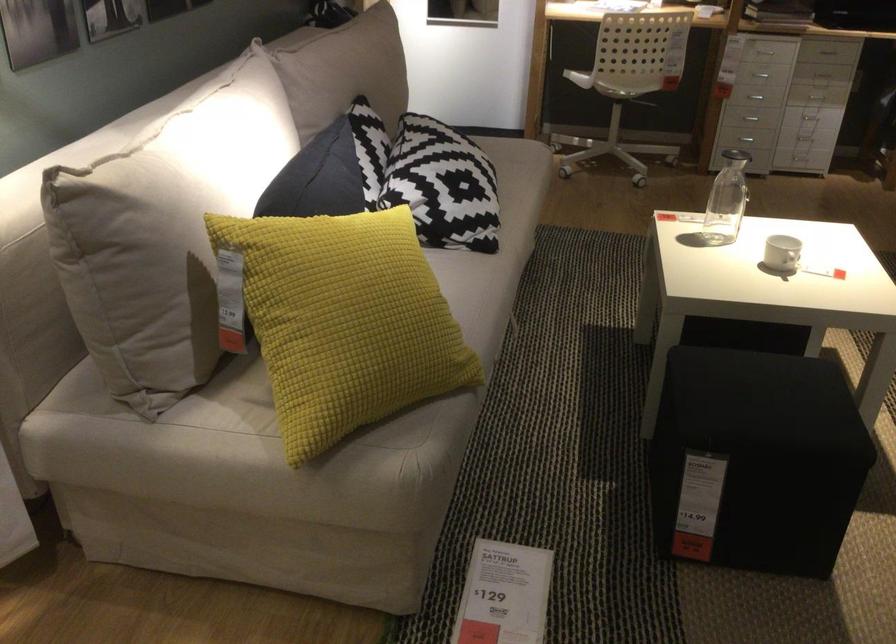
Locate an element on the screen. This screenshot has height=644, width=896. sofa sitting surface is located at coordinates (208, 406).